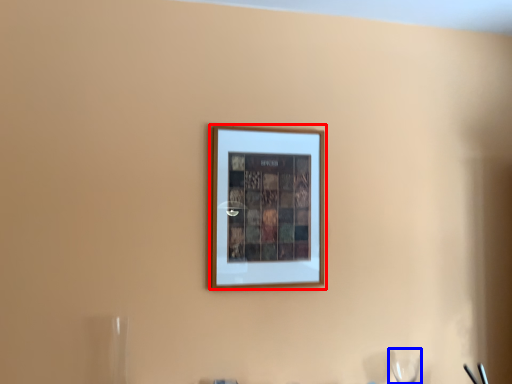
Question: Which point is further to the camera, picture frame (highlighted by a red box) or wine glass (highlighted by a blue box)?

Choices:
 (A) picture frame
 (B) wine glass

Answer: (B)